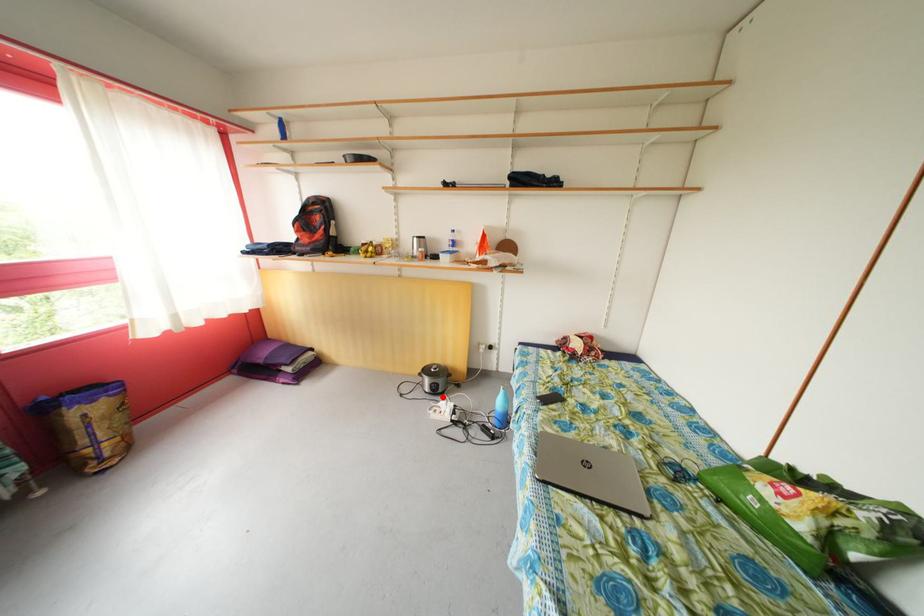
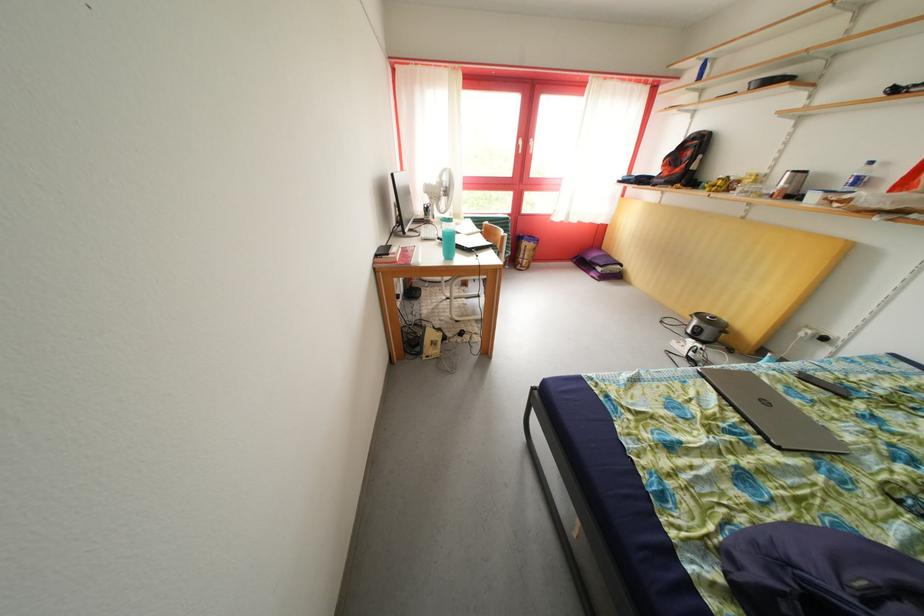
Question: I am providing you with two images of the same scene from different viewpoints. Image1 has a red point marked. In image2, the corresponding 3D location appears at what relative position? Reply with the corresponding letter.

Choices:
 (A) Closer
 (B) Farther

Answer: (A)